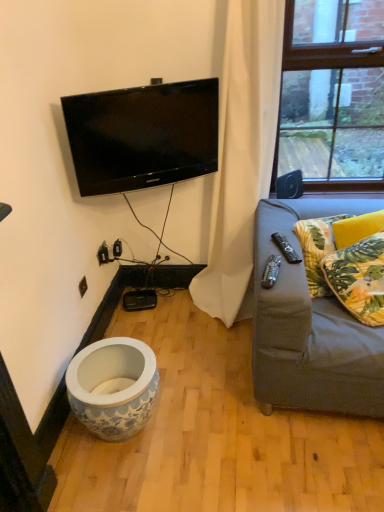
Question: From a real-world perspective, is green leafy fabric pillow at right, which is the second pillow in back-to-front order, positioned under white fabric curtain at upper right based on gravity?

Choices:
 (A) yes
 (B) no

Answer: (A)

Question: Is white fabric curtain at upper right surrounded by green leafy fabric pillow at right, which is the second pillow in back-to-front order?

Choices:
 (A) no
 (B) yes

Answer: (A)

Question: Is green leafy fabric pillow at right, the 1th pillow viewed from the front, not near white fabric curtain at upper right?

Choices:
 (A) no
 (B) yes

Answer: (A)

Question: Is green leafy fabric pillow at right, the 1th pillow viewed from the front, turned away from white fabric curtain at upper right?

Choices:
 (A) no
 (B) yes

Answer: (B)

Question: Does green leafy fabric pillow at right, the 1th pillow viewed from the front, have a larger size compared to white fabric curtain at upper right?

Choices:
 (A) yes
 (B) no

Answer: (B)

Question: Considering the relative positions of green leafy fabric pillow at right, which is the second pillow in back-to-front order, and white fabric curtain at upper right in the image provided, is green leafy fabric pillow at right, which is the second pillow in back-to-front order, to the left of white fabric curtain at upper right from the viewer's perspective?

Choices:
 (A) yes
 (B) no

Answer: (B)

Question: Is green leafy fabric pillow at right, which is the second pillow in back-to-front order, in contact with white glossy vase at lower left?

Choices:
 (A) yes
 (B) no

Answer: (B)

Question: From a real-world perspective, is green leafy fabric pillow at right, which is the second pillow in back-to-front order, located beneath white glossy vase at lower left?

Choices:
 (A) no
 (B) yes

Answer: (A)

Question: Does green leafy fabric pillow at right, the 1th pillow viewed from the front, have a lesser width compared to white glossy vase at lower left?

Choices:
 (A) no
 (B) yes

Answer: (B)

Question: Does green leafy fabric pillow at right, which is the second pillow in back-to-front order, have a lesser height compared to white glossy vase at lower left?

Choices:
 (A) yes
 (B) no

Answer: (A)

Question: Can you confirm if green leafy fabric pillow at right, the 1th pillow viewed from the front, is positioned to the right of white glossy vase at lower left?

Choices:
 (A) yes
 (B) no

Answer: (A)

Question: From the image's perspective, is green leafy fabric pillow at right, which is the second pillow in back-to-front order, beneath white glossy vase at lower left?

Choices:
 (A) yes
 (B) no

Answer: (B)

Question: From the image's perspective, is white fabric curtain at upper right below green leafy fabric pillow at right, which is the second pillow in back-to-front order?

Choices:
 (A) yes
 (B) no

Answer: (B)